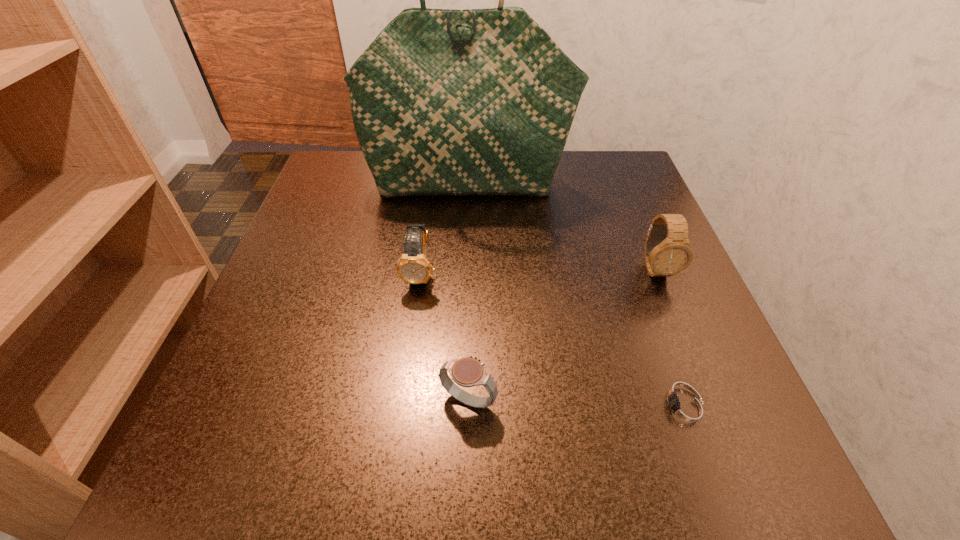
Where is `free space between the shortest watch and the farthest object`? free space between the shortest watch and the farthest object is located at coordinates point(577,296).

This screenshot has height=540, width=960. I want to click on vacant area that lies between the leftmost watch and the tallest watch, so click(538, 271).

I want to click on free space between the third tallest object and the farthest object, so [x=444, y=229].

Identify the location of vacant area that lies between the leftmost watch and the fourth shortest object. The width and height of the screenshot is (960, 540). (538, 271).

Identify the location of vacant space in between the second tallest object and the second shortest object. The image size is (960, 540). (562, 335).

Locate an element on the screen. This screenshot has width=960, height=540. vacant space in between the shortest object and the farthest object is located at coordinates (577, 296).

In order to click on free point between the third shortest watch and the farthest object in this screenshot , I will do `click(444, 229)`.

The width and height of the screenshot is (960, 540). What are the coordinates of `object identified as the third closest to the tallest object` in the screenshot? It's located at (684, 409).

Locate which object is the fourth closest to the tallest watch. Please provide its 2D coordinates. Your answer should be formatted as a tuple, i.e. [(x, y)], where the tuple contains the x and y coordinates of a point satisfying the conditions above.

[(413, 267)]

Select which watch appears as the second closest to the fourth tallest object. Please provide its 2D coordinates. Your answer should be formatted as a tuple, i.e. [(x, y)], where the tuple contains the x and y coordinates of a point satisfying the conditions above.

[(684, 409)]